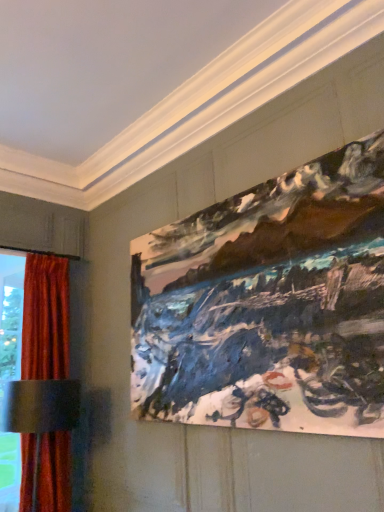
Measure the distance between painted canvas at upper right and camera.

The distance of painted canvas at upper right from camera is 5.73 feet.

This screenshot has width=384, height=512. Describe the element at coordinates (269, 304) in the screenshot. I see `painted canvas at upper right` at that location.

The height and width of the screenshot is (512, 384). What are the coordinates of `painted canvas at upper right` in the screenshot? It's located at (269, 304).

In order to face velvet red curtain at left, should I rotate leftwards or rightwards?

Rotate left and turn 19.254 degrees.

What is the approximate height of velvet red curtain at left?

6.54 feet.

Where is `velvet red curtain at left`? The height and width of the screenshot is (512, 384). velvet red curtain at left is located at coordinates (46, 318).

Measure the distance between velvet red curtain at left and camera.

The depth of velvet red curtain at left is 3.23 meters.

The width and height of the screenshot is (384, 512). What do you see at coordinates (46, 318) in the screenshot? I see `velvet red curtain at left` at bounding box center [46, 318].

The image size is (384, 512). Find the location of `painted canvas at upper right`. painted canvas at upper right is located at coordinates (269, 304).

Between painted canvas at upper right and velvet red curtain at left, which one appears on the left side from the viewer's perspective?

Positioned to the left is velvet red curtain at left.

Which object is further away from the camera, painted canvas at upper right or velvet red curtain at left?

velvet red curtain at left is further from the camera.

Which is nearer, (296, 262) or (24, 502)?

Point (296, 262) is positioned closer to the camera compared to point (24, 502).

From the picture: From the image's perspective, is painted canvas at upper right on top of velvet red curtain at left?

Yes.

From a real-world perspective, between painted canvas at upper right and velvet red curtain at left, who is vertically lower?

From a 3D spatial view, velvet red curtain at left is below.

Which object is thinner, painted canvas at upper right or velvet red curtain at left?

With smaller width is painted canvas at upper right.

Which of these two, painted canvas at upper right or velvet red curtain at left, stands taller?

velvet red curtain at left is taller.

From the picture: Does painted canvas at upper right have a larger size compared to velvet red curtain at left?

No.

Is velvet red curtain at left located within painted canvas at upper right?

That's incorrect, velvet red curtain at left is not inside painted canvas at upper right.

Is there a large distance between painted canvas at upper right and velvet red curtain at left?

Yes, painted canvas at upper right is far from velvet red curtain at left.

Is painted canvas at upper right positioned with its back to velvet red curtain at left?

painted canvas at upper right is not turned away from velvet red curtain at left.

You are a GUI agent. You are given a task and a screenshot of the screen. Output one action in this format:
    pyautogui.click(x=<x>, y=<y>)
    Task: Click on the picture frame located above the velvet red curtain at left (from the image's perspective)
    The image size is (384, 512).
    Given the screenshot: What is the action you would take?
    pyautogui.click(x=269, y=304)

Which object is positioned more to the right, velvet red curtain at left or painted canvas at upper right?

Positioned to the right is painted canvas at upper right.

Is velvet red curtain at left closer to the viewer compared to painted canvas at upper right?

No, it is behind painted canvas at upper right.

Which is less distant, (61, 357) or (342, 426)?

Point (61, 357) appears to be farther away from the viewer than point (342, 426).

Consider the image. From the image's perspective, is velvet red curtain at left on top of painted canvas at upper right?

Incorrect, from the image's perspective, velvet red curtain at left is lower than painted canvas at upper right.

In the scene shown: From a real-world perspective, between velvet red curtain at left and painted canvas at upper right, who is vertically higher?

In real-world perspective, painted canvas at upper right is above.

Does velvet red curtain at left have a greater width compared to painted canvas at upper right?

Yes.

From their relative heights in the image, would you say velvet red curtain at left is taller or shorter than painted canvas at upper right?

velvet red curtain at left is taller than painted canvas at upper right.

Considering the sizes of objects velvet red curtain at left and painted canvas at upper right in the image provided, who is bigger, velvet red curtain at left or painted canvas at upper right?

Bigger between the two is velvet red curtain at left.

Is velvet red curtain at left inside the boundaries of painted canvas at upper right, or outside?

velvet red curtain at left is spatially situated outside painted canvas at upper right.

Is velvet red curtain at left positioned far away from painted canvas at upper right?

Yes.

Is velvet red curtain at left facing away from painted canvas at upper right?

No, velvet red curtain at left is not facing away from painted canvas at upper right.

How different are the orientations of velvet red curtain at left and painted canvas at upper right in degrees?

The angle between the facing direction of velvet red curtain at left and the facing direction of painted canvas at upper right is 88.4 degrees.

This screenshot has width=384, height=512. In the image, there is a velvet red curtain at left. What are the coordinates of `picture frame above it (from the image's perspective)` in the screenshot? It's located at (x=269, y=304).

Identify the location of curtain behind the painted canvas at upper right. (46, 318).

Identify the location of picture frame located above the velvet red curtain at left (from the image's perspective). (269, 304).